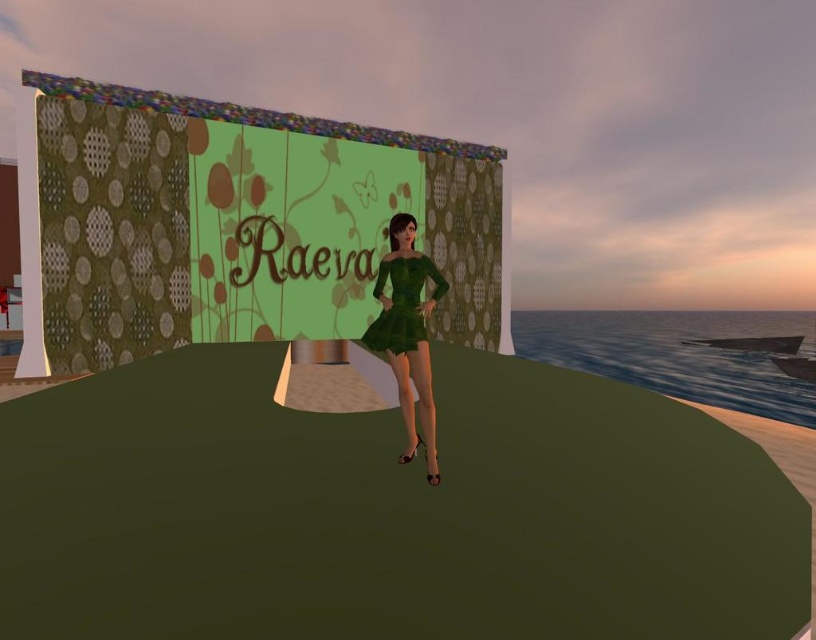
You are a virtual stylist in this digital environment. You need to adjust the outfits of the character wearing both the green satin dress at center and the green velvet dress at center. Which dress is positioned lower on the character?

The green satin dress at center is below the green velvet dress at center, so the green satin dress at center is positioned lower on the character.

Consider the image. You are a fashion designer observing two dresses displayed on a platform in a twilight setting. Which dress has a wider silhouette? The options are the green satin dress at center and the green velvet dress at center.

The green satin dress at center has a wider silhouette than the green velvet dress at center according to the description.